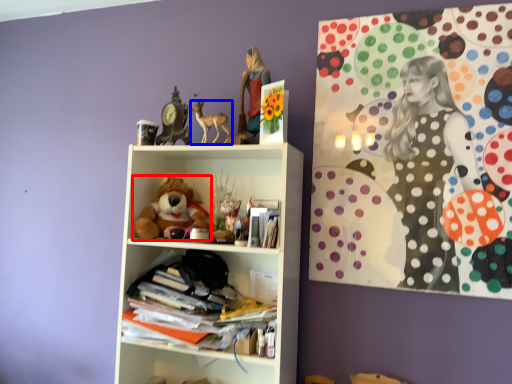
Question: Among these objects, which one is farthest to the camera, teddy bear (highlighted by a red box) or toy (highlighted by a blue box)?

Choices:
 (A) teddy bear
 (B) toy

Answer: (A)